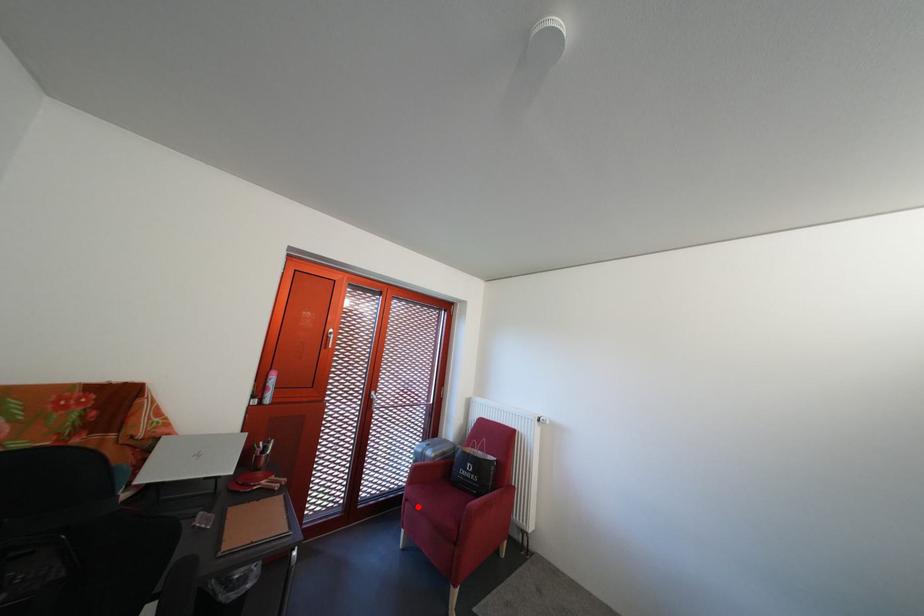
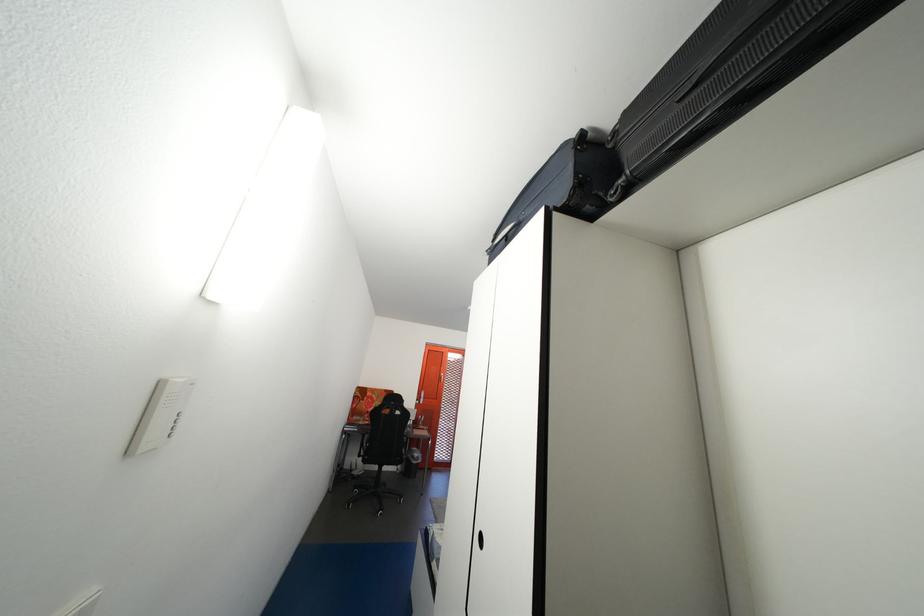
Question: I am providing you with two images of the same scene from different viewpoints. A red point is marked on the first image. At the location where the point appears in image 1, is it still visible in image 2?

Choices:
 (A) Yes
 (B) No

Answer: (B)